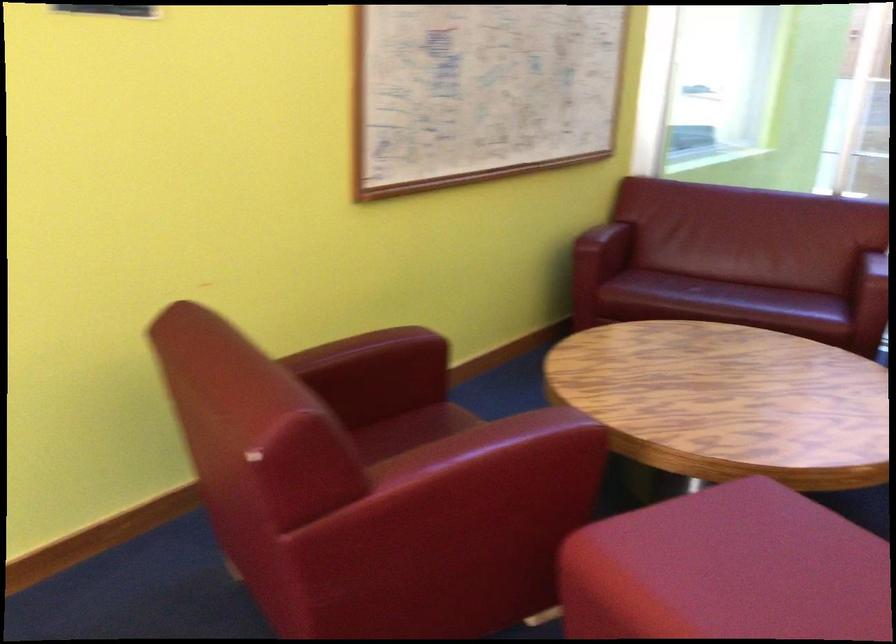
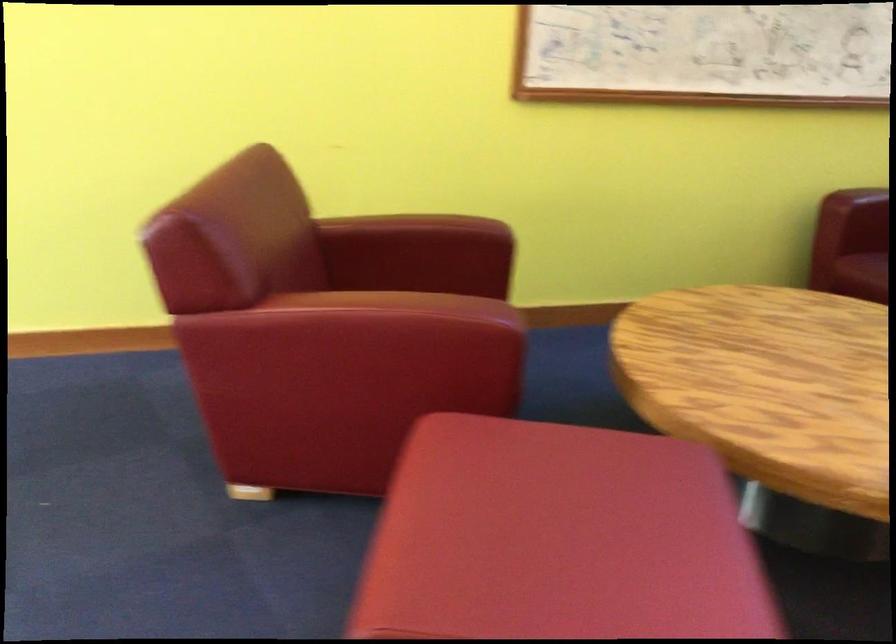
The point at (467,453) is marked in the first image. Where is the corresponding point in the second image?

(356, 301)